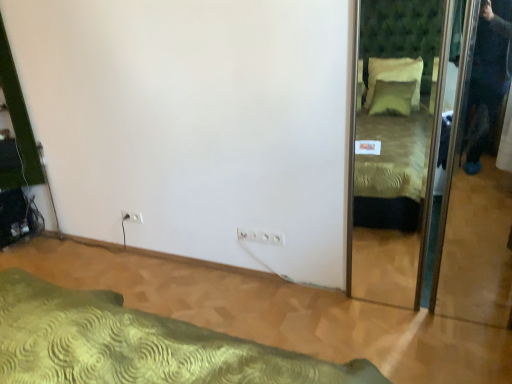
Question: Which direction should I rotate to look at white plastic electric outlet at center, which is counted as the 2th electric outlet, starting from the back?

Choices:
 (A) left
 (B) right

Answer: (B)

Question: Considering the relative sizes of white plastic electric outlet at lower left, arranged as the second electric outlet when viewed from the front, and white plastic electric outlet at center, which ranks as the 1th electric outlet in right-to-left order, in the image provided, is white plastic electric outlet at lower left, arranged as the second electric outlet when viewed from the front, bigger than white plastic electric outlet at center, which ranks as the 1th electric outlet in right-to-left order,?

Choices:
 (A) yes
 (B) no

Answer: (B)

Question: Is white plastic electric outlet at lower left, the 1th electric outlet from the back, next to white plastic electric outlet at center, which ranks as the 1th electric outlet in right-to-left order, and touching it?

Choices:
 (A) yes
 (B) no

Answer: (B)

Question: Is white plastic electric outlet at lower left, marked as the 2th electric outlet in a bottom-to-top arrangement, turned away from white plastic electric outlet at center, which is counted as the 2th electric outlet, starting from the back?

Choices:
 (A) yes
 (B) no

Answer: (B)

Question: Is the position of white plastic electric outlet at lower left, the 1th electric outlet when ordered from left to right, less distant than that of white plastic electric outlet at center, which ranks as the 1th electric outlet in right-to-left order?

Choices:
 (A) yes
 (B) no

Answer: (B)

Question: Does white plastic electric outlet at lower left, arranged as the second electric outlet when viewed from the front, have a lesser height compared to white plastic electric outlet at center, which ranks as the 2th electric outlet in left-to-right order?

Choices:
 (A) yes
 (B) no

Answer: (A)

Question: Can you confirm if white plastic electric outlet at lower left, the 1th electric outlet from the back, is thinner than white plastic electric outlet at center, which ranks as the 1th electric outlet in right-to-left order?

Choices:
 (A) yes
 (B) no

Answer: (A)

Question: Does white plastic electric outlet at lower left, marked as the 2th electric outlet in a right-to-left arrangement, have a lesser width compared to green textured bed at lower left?

Choices:
 (A) yes
 (B) no

Answer: (A)

Question: Is green textured bed at lower left completely or partially inside white plastic electric outlet at lower left, positioned as the 1th electric outlet in top-to-bottom order?

Choices:
 (A) no
 (B) yes

Answer: (A)

Question: From the image's perspective, would you say white plastic electric outlet at lower left, marked as the 2th electric outlet in a bottom-to-top arrangement, is positioned over green textured bed at lower left?

Choices:
 (A) no
 (B) yes

Answer: (B)

Question: From the image's perspective, is white plastic electric outlet at lower left, the 1th electric outlet when ordered from left to right, beneath green textured bed at lower left?

Choices:
 (A) yes
 (B) no

Answer: (B)

Question: Is white plastic electric outlet at lower left, marked as the 2th electric outlet in a right-to-left arrangement, completely or partially outside of green textured bed at lower left?

Choices:
 (A) no
 (B) yes

Answer: (B)

Question: Are white plastic electric outlet at lower left, positioned as the 1th electric outlet in top-to-bottom order, and green textured bed at lower left beside each other?

Choices:
 (A) no
 (B) yes

Answer: (A)

Question: From a real-world perspective, is white plastic electric outlet at lower left, the 1th electric outlet from the back, positioned under green textured mirror at right based on gravity?

Choices:
 (A) no
 (B) yes

Answer: (B)